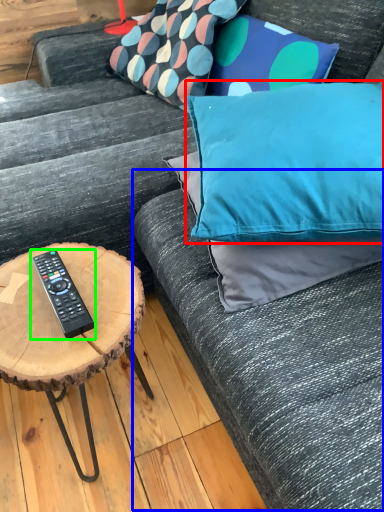
Question: Estimate the real-world distances between objects in this image. Which object is closer to pillow (highlighted by a red box), couch (highlighted by a blue box) or remote control (highlighted by a green box)?

Choices:
 (A) couch
 (B) remote control

Answer: (A)